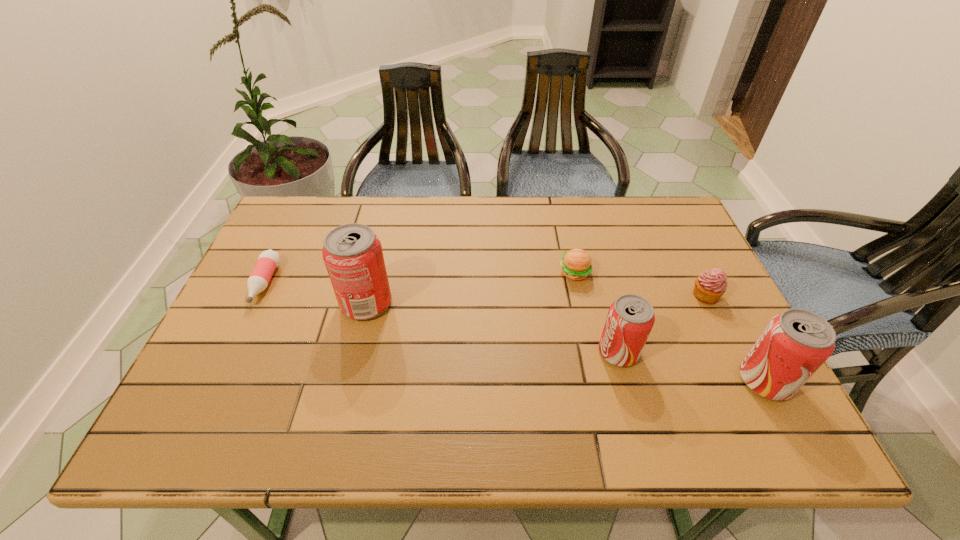
This screenshot has width=960, height=540. I want to click on vacant space located 0.130m on the right of the second object from left to right, so click(x=443, y=303).

This screenshot has width=960, height=540. I want to click on free space located on the left of the shortest soda can, so click(530, 352).

Image resolution: width=960 pixels, height=540 pixels. Identify the location of free location located on the back of the second shortest soda can. (702, 259).

Where is `free space located on the front of the third shortest object`? Image resolution: width=960 pixels, height=540 pixels. free space located on the front of the third shortest object is located at coordinates (741, 369).

At what (x,y) coordinates should I click in order to perform the action: click on vacant space located 0.180m on the back of the hamburger. Please return your answer as a coordinate pair (x, y). This screenshot has width=960, height=540. Looking at the image, I should click on (564, 221).

At what (x,y) coordinates should I click in order to perform the action: click on vacant space situated 0.130m with the cap open on the leftmost object. Please return your answer as a coordinate pair (x, y). Looking at the image, I should click on (231, 351).

I want to click on object situated at the left edge, so [268, 260].

Where is `soda can at the right edge`? Image resolution: width=960 pixels, height=540 pixels. soda can at the right edge is located at coordinates (795, 343).

I want to click on cupcake that is positioned at the right edge, so click(x=709, y=287).

This screenshot has height=540, width=960. In order to click on object positioned at the near right corner in this screenshot , I will do `click(795, 343)`.